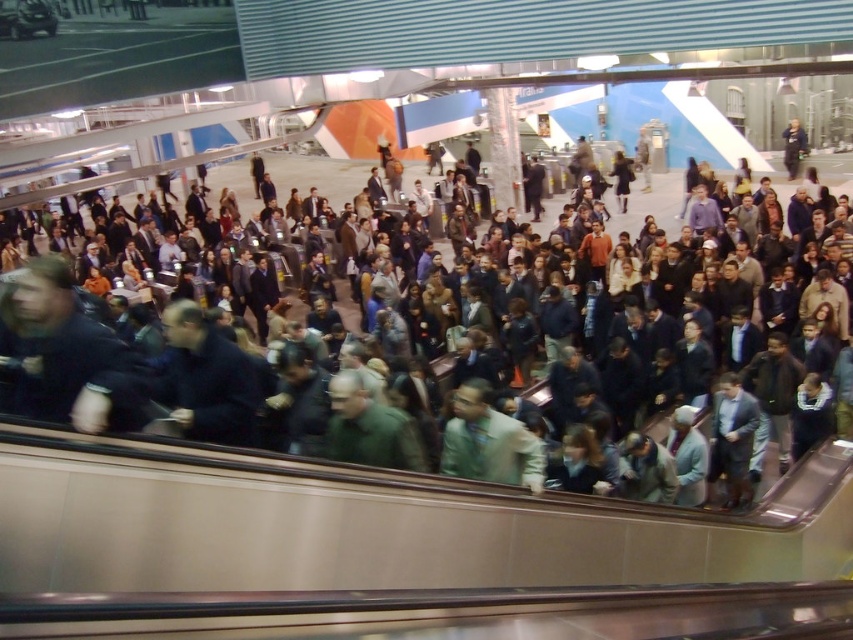
Question: Is light beige fabric shirt at center closer to the viewer compared to dark gray jacket at center?

Choices:
 (A) yes
 (B) no

Answer: (A)

Question: Which point appears closest to the camera in this image?

Choices:
 (A) (506, 436)
 (B) (635, 218)

Answer: (A)

Question: Is light beige fabric shirt at center behind dark gray jacket at center?

Choices:
 (A) yes
 (B) no

Answer: (B)

Question: Among these points, which one is nearest to the camera?

Choices:
 (A) (489, 412)
 (B) (340, 182)

Answer: (A)

Question: Is light beige fabric shirt at center above dark gray jacket at center?

Choices:
 (A) yes
 (B) no

Answer: (B)